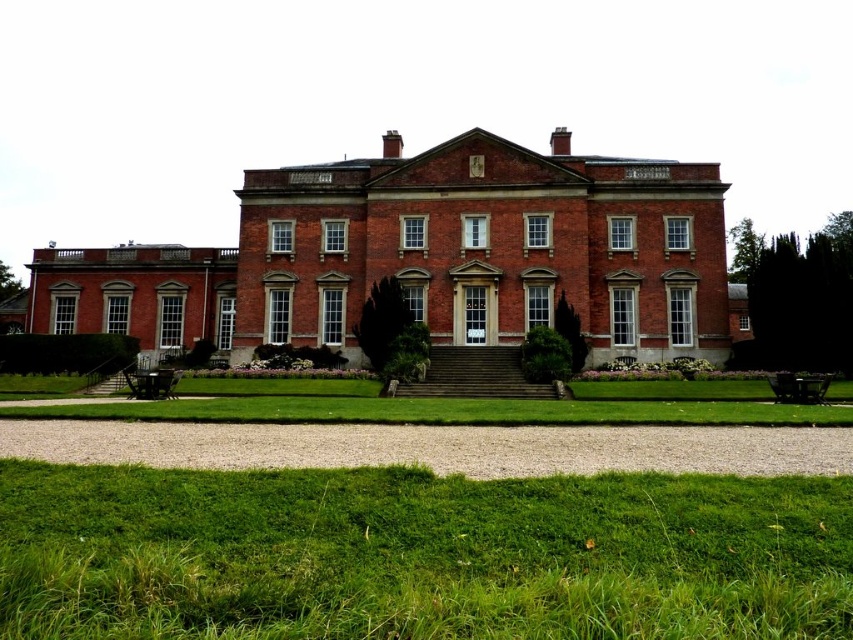
Question: Which object is farther from the camera taking this photo?

Choices:
 (A) dark brown wooden park bench at lower right
 (B) green grass at lower center
 (C) wooden park bench at lower left
 (D) brick mansion at center

Answer: (D)

Question: Which object is farther from the camera taking this photo?

Choices:
 (A) dark brown wooden park bench at lower right
 (B) brick mansion at center

Answer: (B)

Question: Which is nearer to the green grass at lower center?

Choices:
 (A) dark brown wooden park bench at lower right
 (B) brick mansion at center
 (C) wooden park bench at lower left

Answer: (A)

Question: Can you confirm if green grass at lower center is positioned below wooden park bench at lower left?

Choices:
 (A) yes
 (B) no

Answer: (A)

Question: Is green grass at lower center smaller than dark brown wooden park bench at lower right?

Choices:
 (A) no
 (B) yes

Answer: (A)

Question: Observing the image, what is the correct spatial positioning of brick mansion at center in reference to wooden park bench at lower left?

Choices:
 (A) above
 (B) below

Answer: (A)